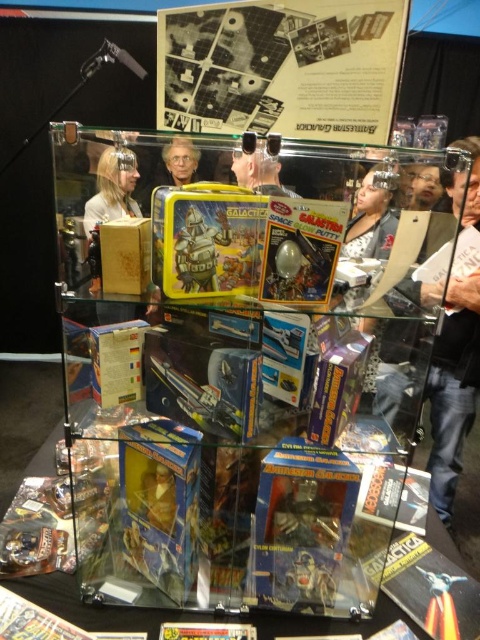
Question: Which point is closer to the camera taking this photo?

Choices:
 (A) [76, 451]
 (B) [194, 22]

Answer: (B)

Question: Where is matte paper comic book at upper center located in relation to yellow paper comic book at center in the image?

Choices:
 (A) right
 (B) left

Answer: (A)

Question: Which of the following is the closest to the observer?

Choices:
 (A) (310, 593)
 (B) (144, 218)

Answer: (B)

Question: Does matte paper comic book at upper center have a lesser width compared to matte black jacket at right?

Choices:
 (A) yes
 (B) no

Answer: (B)

Question: Considering the real-world distances, which object is closest to the yellow paper comic book at center?

Choices:
 (A) matte paper comic book at upper center
 (B) matte black jacket at right
 (C) transparent plastic glass box at center

Answer: (C)

Question: Does matte black jacket at right lie behind metallic silver robot at lower center?

Choices:
 (A) no
 (B) yes

Answer: (B)